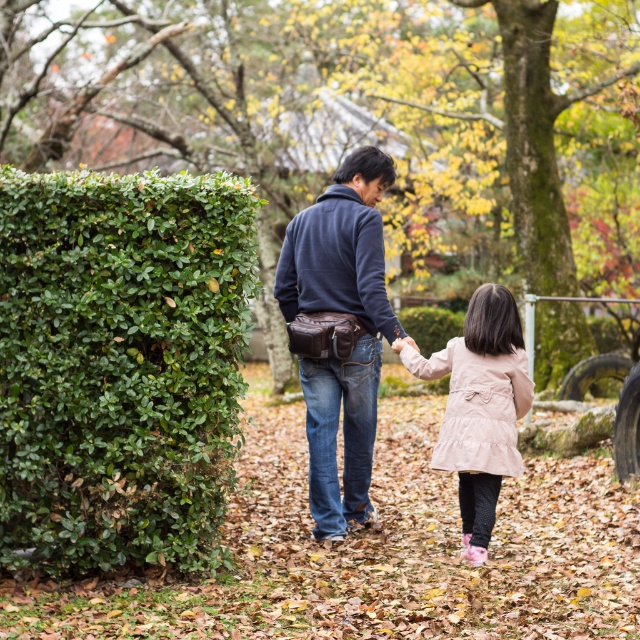
Question: Does green leafy hedge at left have a greater width compared to pale pink suede coat at center?

Choices:
 (A) no
 (B) yes

Answer: (B)

Question: Observing the image, what is the correct spatial positioning of green leafy hedge at left in reference to pale pink suede coat at center?

Choices:
 (A) below
 (B) above

Answer: (B)

Question: Is green leafy hedge at left to the right of pale pink suede coat at center from the viewer's perspective?

Choices:
 (A) yes
 (B) no

Answer: (B)

Question: Which point is farther to the camera?

Choices:
 (A) (97, 397)
 (B) (477, 352)

Answer: (B)

Question: Which point appears farthest from the camera in this image?

Choices:
 (A) (40, 227)
 (B) (512, 321)

Answer: (B)

Question: Which of these objects is positioned farthest from the pale pink suede coat at center?

Choices:
 (A) green leafy hedge at left
 (B) navy blue sweater at center

Answer: (A)